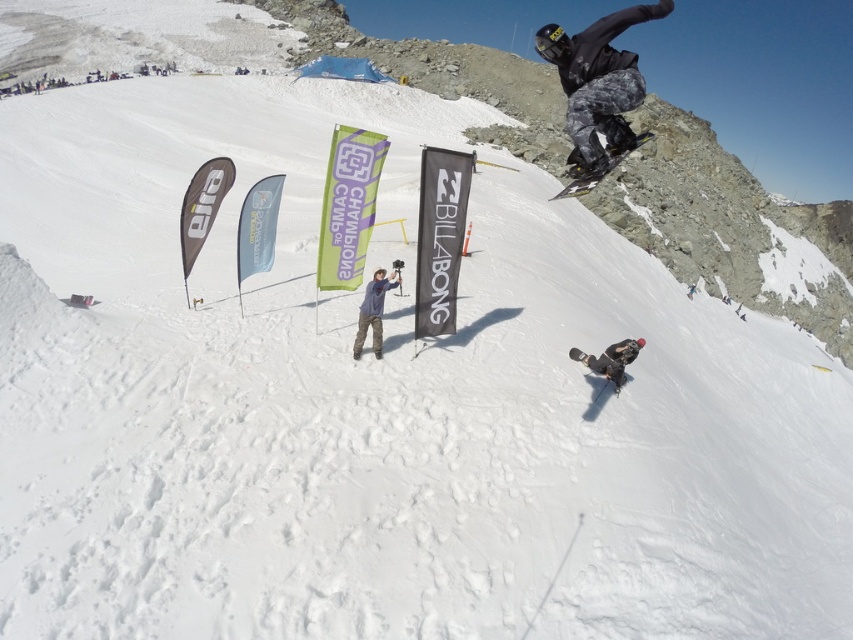
You are a photographer standing at the lower center of the image. You want to take a photo of the camouflage pants at upper right and the black matte snowboard at lower center. Which object will appear larger in your photo?

The camouflage pants at upper right will appear larger in the photo because it is much taller than the black matte snowboard at lower center.

You are a photographer at the snowboarding event. You need to capture a photo that includes both the denim pants at center and the dark gray snowboarder at lower right. Which one will appear larger in the photo?

The denim pants at center will appear larger in the photo because it is taller than the dark gray snowboarder at lower right.

In the scene shown: You are a photographer positioned near the banners in the midground. You need to capture a photo that includes both the dark gray snowboarder at lower right and the black matte snowboard at lower center. Considering their sizes, which object should you focus on first to ensure both are in frame?

The dark gray snowboarder at lower right is much taller than the black matte snowboard at lower center, so you should focus on the dark gray snowboarder at lower right first to ensure both are in frame.